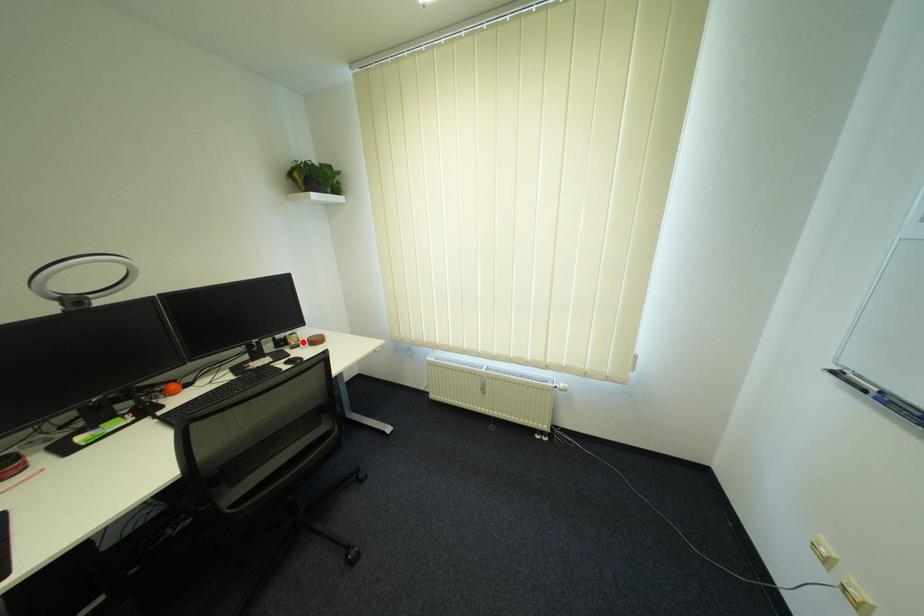
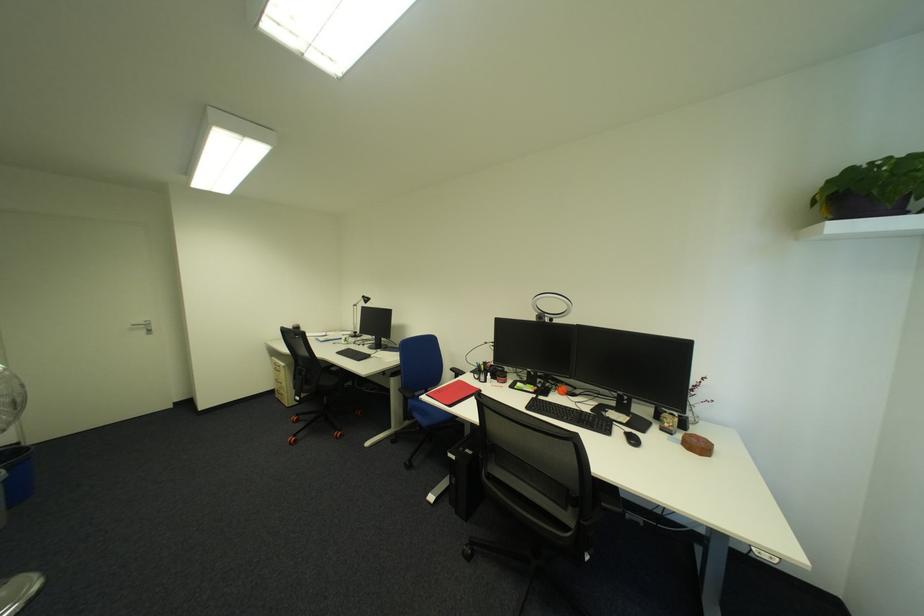
The point at the highlighted location is marked in the first image. Where is the corresponding point in the second image?

(677, 424)